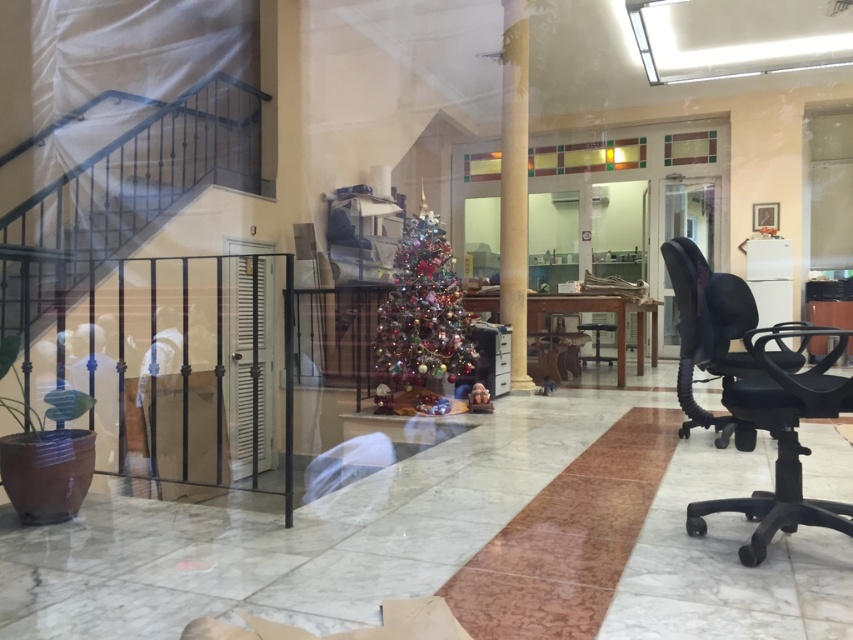
You are organizing a holiday party and need to place a 1.2 meter wide table between the shiny metallic christmas tree at center and the white marble pillar at center. Can the table fit there?

The shiny metallic christmas tree at center is positioned on the left side of the white marble pillar at center, so there is space between them. However, the exact distance isn not provided. The table may or may not fit depending on the actual spacing between the two objects.

You are standing in the room and want to move to the staircase. You see a black matte swivel chair at right located at point (780, 436). Is the staircase behind the black matte swivel chair at right or in front of it?

The staircase is behind the black matte swivel chair at right because the chair is in the foreground and the staircase is in the background.